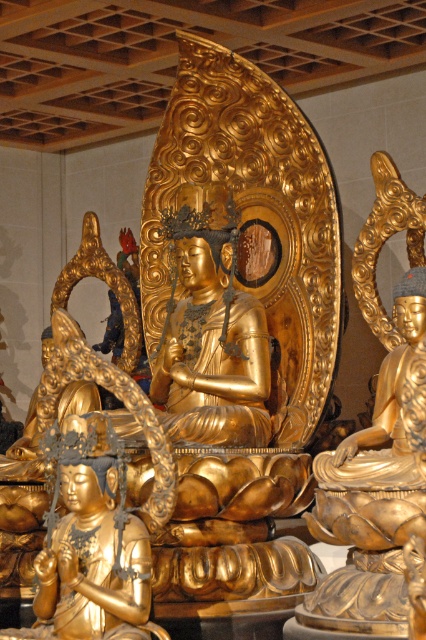
Who is higher up, gold polished statue at right or gold/gilded statue at lower left?

gold polished statue at right

Between point (423, 323) and point (51, 614), which one is positioned in front?

Positioned in front is point (51, 614).

Locate an element on the screen. The height and width of the screenshot is (640, 426). gold polished statue at right is located at coordinates (376, 445).